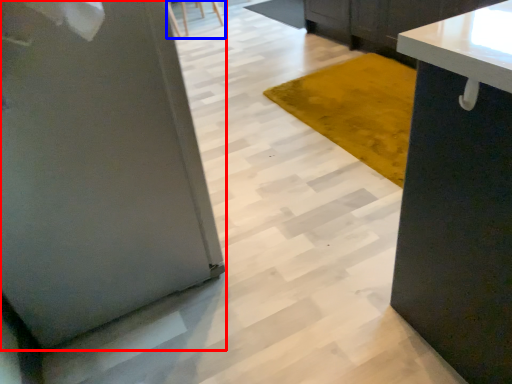
Question: Which object appears closest to the camera in this image, pillar (highlighted by a red box) or chair (highlighted by a blue box)?

Choices:
 (A) pillar
 (B) chair

Answer: (A)